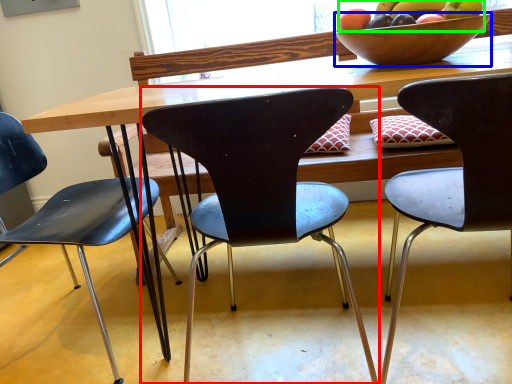
Question: Which object is the farthest from chair (highlighted by a red box)? Choose among these: bowl (highlighted by a blue box) or grapefruit (highlighted by a green box).

Choices:
 (A) bowl
 (B) grapefruit

Answer: (B)